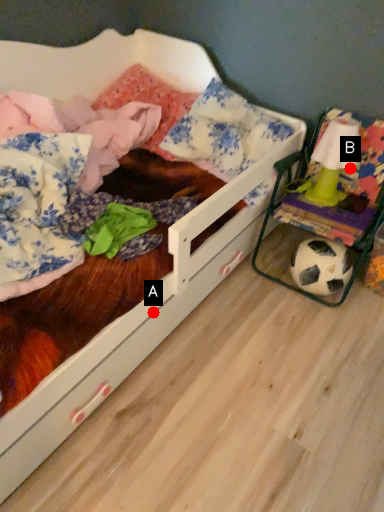
Question: Two points are circled on the image, labeled by A and B beside each circle. Which of the following is the farthest from the observer?

Choices:
 (A) A is further
 (B) B is further

Answer: (B)